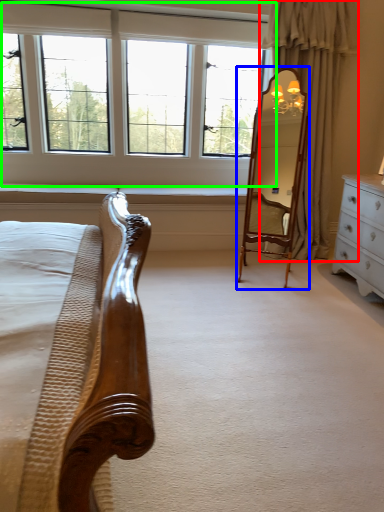
Question: Considering the real-world distances, which object is closest to curtain (highlighted by a red box)? mirror (highlighted by a blue box) or window (highlighted by a green box).

Choices:
 (A) mirror
 (B) window

Answer: (A)